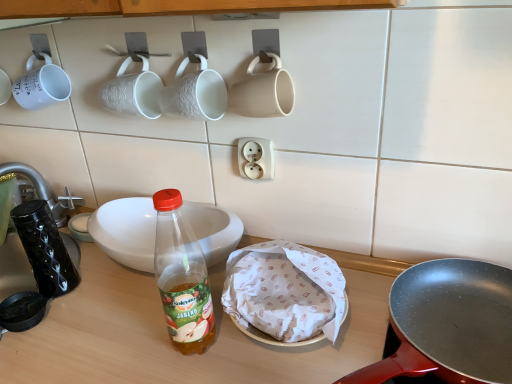
Locate an element on the screen. vacant region below matte black frying pan at center right (from a real-world perspective) is located at coordinates (426, 324).